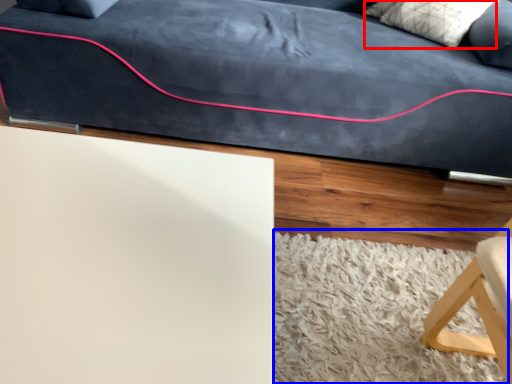
Question: Which point is closer to the camera, pillow (highlighted by a red box) or mat (highlighted by a blue box)?

Choices:
 (A) pillow
 (B) mat

Answer: (B)